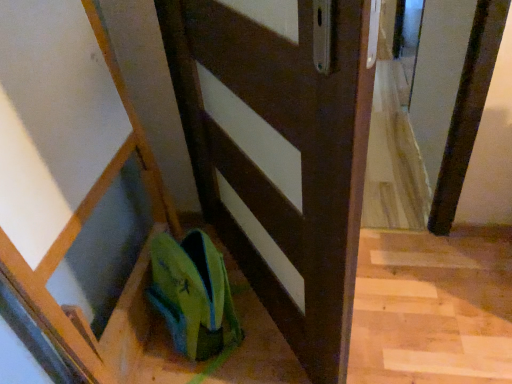
Question: Is green fabric shoe at lower center shorter than matte brown door at center?

Choices:
 (A) no
 (B) yes

Answer: (B)

Question: Is green fabric shoe at lower center at the left side of matte brown door at center?

Choices:
 (A) no
 (B) yes

Answer: (B)

Question: Is green fabric shoe at lower center not inside matte brown door at center?

Choices:
 (A) no
 (B) yes

Answer: (B)

Question: Is green fabric shoe at lower center positioned far away from matte brown door at center?

Choices:
 (A) yes
 (B) no

Answer: (B)

Question: Is green fabric shoe at lower center bigger than matte brown door at center?

Choices:
 (A) yes
 (B) no

Answer: (B)

Question: Could you tell me if green fabric shoe at lower center is facing matte brown door at center?

Choices:
 (A) no
 (B) yes

Answer: (A)

Question: Is matte brown door at center thinner than green fabric shoe at lower center?

Choices:
 (A) no
 (B) yes

Answer: (B)

Question: Is matte brown door at center smaller than green fabric shoe at lower center?

Choices:
 (A) no
 (B) yes

Answer: (A)

Question: Considering the relative positions of matte brown door at center and green fabric shoe at lower center in the image provided, is matte brown door at center to the left of green fabric shoe at lower center from the viewer's perspective?

Choices:
 (A) no
 (B) yes

Answer: (A)

Question: Is green fabric shoe at lower center at the back of matte brown door at center?

Choices:
 (A) no
 (B) yes

Answer: (B)

Question: Could you tell me if matte brown door at center is facing green fabric shoe at lower center?

Choices:
 (A) yes
 (B) no

Answer: (A)

Question: Can you confirm if matte brown door at center is wider than green fabric shoe at lower center?

Choices:
 (A) no
 (B) yes

Answer: (A)

Question: Does point (214, 137) appear closer or farther from the camera than point (209, 244)?

Choices:
 (A) farther
 (B) closer

Answer: (A)